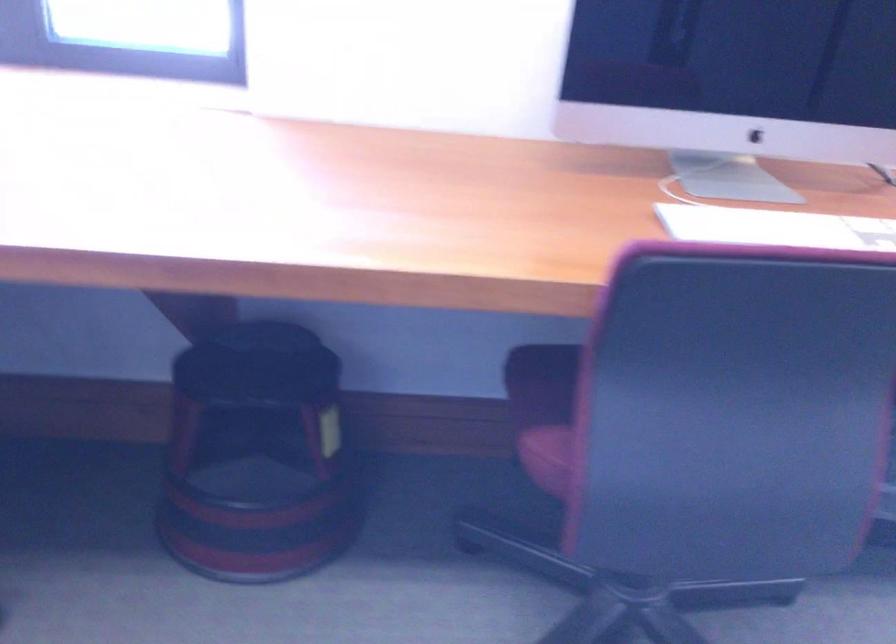
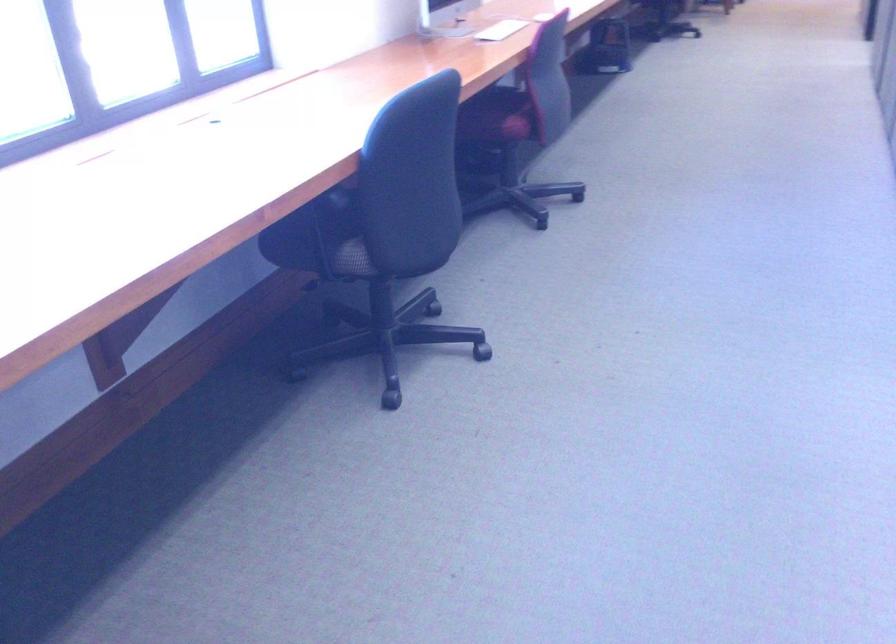
The point at (x=544, y=413) is marked in the first image. Where is the corresponding point in the second image?

(497, 116)